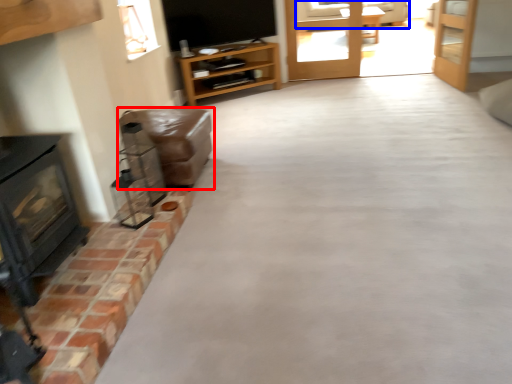
Question: Which object is closer to the camera taking this photo, furniture (highlighted by a red box) or couch (highlighted by a blue box)?

Choices:
 (A) furniture
 (B) couch

Answer: (A)